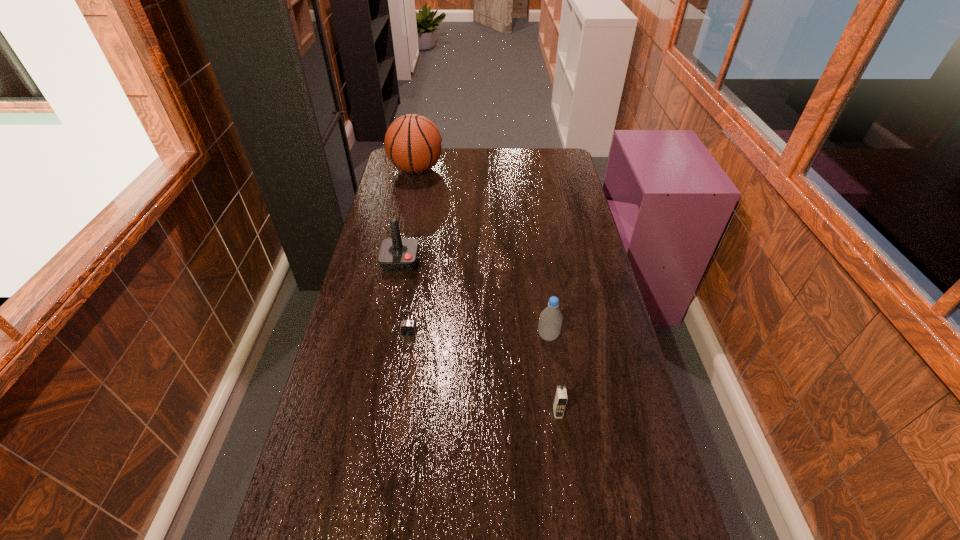
At what (x,y) coordinates should I click in order to perform the action: click on vacant space located 0.200m on the shackle of the shortest object. Please return your answer as a coordinate pair (x, y). Image resolution: width=960 pixels, height=540 pixels. Looking at the image, I should click on (400, 392).

What are the coordinates of `object located at the far edge` in the screenshot? It's located at (x=413, y=143).

You are a GUI agent. You are given a task and a screenshot of the screen. Output one action in this format:
    pyautogui.click(x=<x>, y=<y>)
    Task: Click on the basketball that is at the left edge
    This screenshot has height=540, width=960.
    Given the screenshot: What is the action you would take?
    pyautogui.click(x=413, y=143)

Find the location of a particular element. The height and width of the screenshot is (540, 960). joystick that is at the left edge is located at coordinates (396, 254).

Where is `object present at the far left corner`? object present at the far left corner is located at coordinates (413, 143).

Where is `vacant region at the far edge`? The height and width of the screenshot is (540, 960). vacant region at the far edge is located at coordinates (530, 160).

Image resolution: width=960 pixels, height=540 pixels. I want to click on vacant space at the left edge of the desktop, so click(x=352, y=332).

The width and height of the screenshot is (960, 540). In the image, there is a desktop. In order to click on free space at the right edge in this screenshot , I will do `click(602, 315)`.

At what (x,y) coordinates should I click in order to perform the action: click on blank area at the far left corner. Please return your answer as a coordinate pair (x, y). This screenshot has width=960, height=540. Looking at the image, I should click on (395, 172).

This screenshot has height=540, width=960. Identify the location of vacant region between the nearest object and the tallest object. (487, 291).